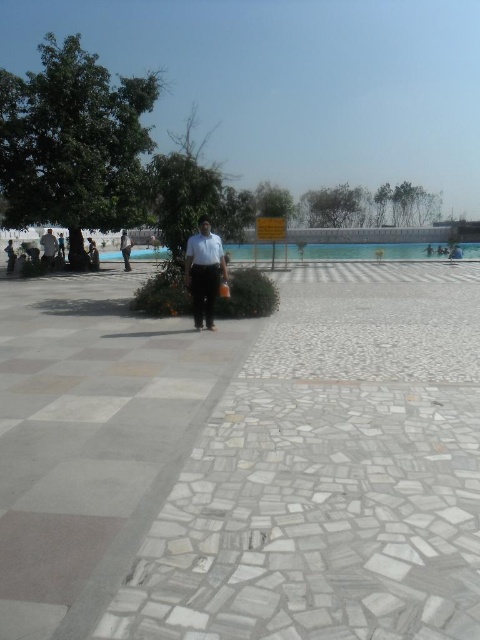
You are standing at the point labeled point (319, 563) and want to walk to the point labeled point (264, 257). Which direction should you move to get closer to your destination?

You should move away from the viewer because point (264, 257) is further away than point (319, 563).

You are standing on the white mosaic pavement at center and want to walk to the clear glass pool at center. Which direction should you move towards?

The white mosaic pavement at center is positioned on the left side of the clear glass pool at center, so you should move to the right to reach the clear glass pool at center.

You are standing at the camera position and want to walk to the clear glass pool at center. How many steps would you need to take if each step covers about 3 feet?

The clear glass pool at center is 57.07 feet away. Dividing 57.07 by 3 gives approximately 19 steps. So, you would need around 19 steps to reach the clear glass pool at center.